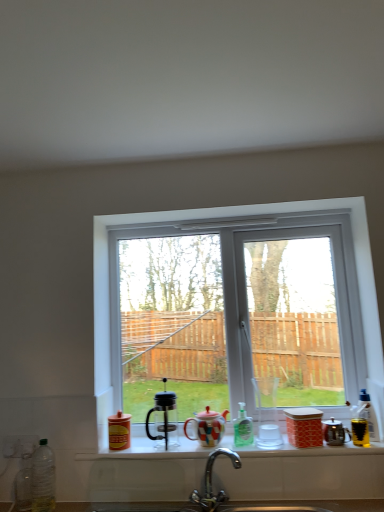
At what (x,y) coordinates should I click in order to perform the action: click on vacant area to the left of transparent glass coffee press at center, marked as the third appliance in a right-to-left arrangement. Please return your answer as a coordinate pair (x, y). Image resolution: width=384 pixels, height=512 pixels. Looking at the image, I should click on (138, 444).